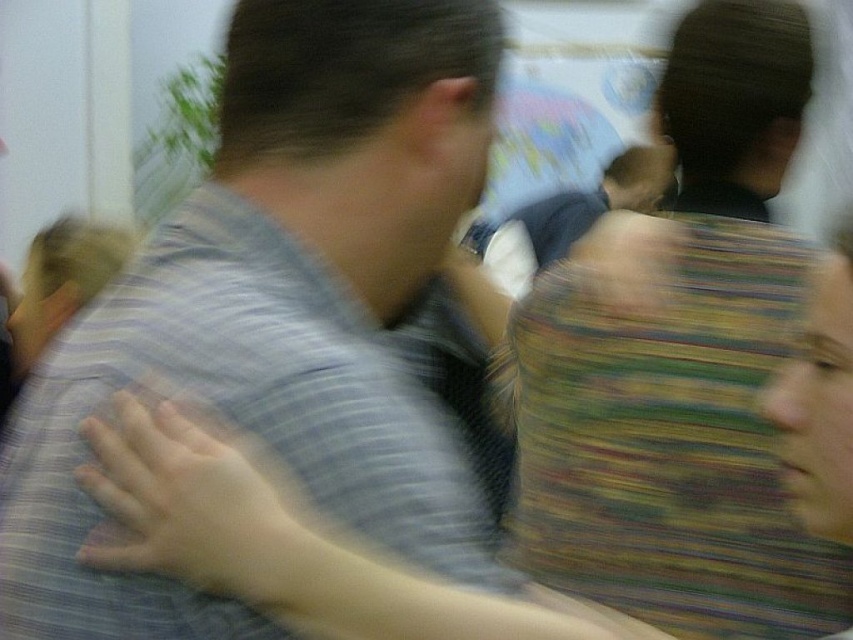
Question: Is gray striped shirt at center thinner than matte gray shirt at upper left?

Choices:
 (A) yes
 (B) no

Answer: (B)

Question: Estimate the real-world distances between objects in this image. Which object is farther from the matte gray shirt at upper left?

Choices:
 (A) gray striped shirt at center
 (B) striped fabric bag at center

Answer: (B)

Question: Which of these objects is positioned farthest from the striped fabric bag at center?

Choices:
 (A) matte gray shirt at upper left
 (B) gray striped shirt at center

Answer: (A)

Question: Which of the following is the closest to the observer?

Choices:
 (A) (155, 276)
 (B) (558, 410)

Answer: (A)

Question: In this image, where is gray striped shirt at center located relative to matte gray shirt at upper left?

Choices:
 (A) above
 (B) below

Answer: (A)

Question: Is gray striped shirt at center positioned behind matte gray shirt at upper left?

Choices:
 (A) yes
 (B) no

Answer: (A)